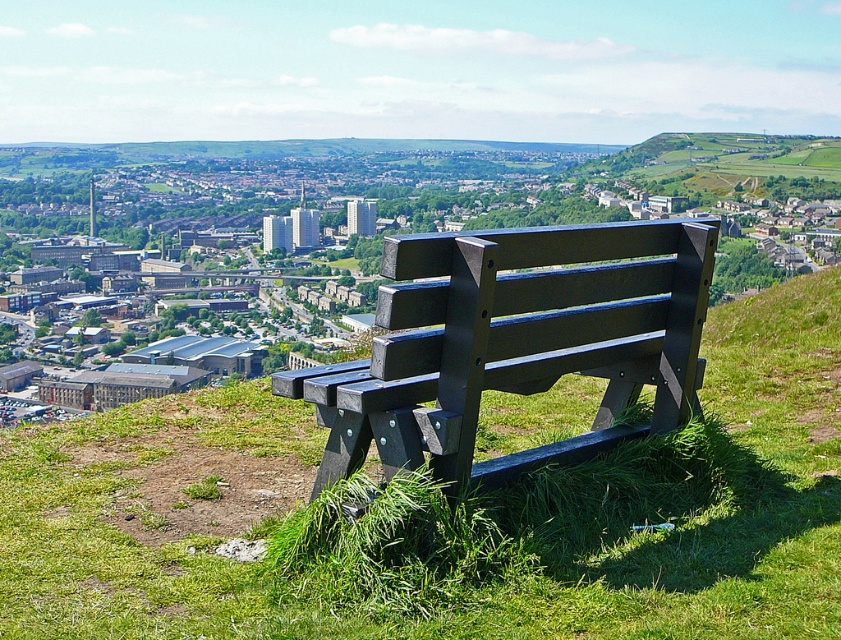
From the picture: You are planning to place a small potted plant between the green grassy bench at center and the matte black bench at center. Which bench should you place it closer to if you want the plant to be near the larger one?

The green grassy bench at center is bigger than the matte black bench at center, so you should place the plant closer to the green grassy bench at center.

You are a landscape architect designing a new park. You have two benches to place in the central area. The green grassy bench at center and the matte black bench at center. The park has a strict rule that benches must be at least 8 feet apart to ensure visitors have enough space. Based on the image, can both benches be placed in the central area without violating the rule?

The green grassy bench at center and the matte black bench at center are 7.27 feet apart from each other. Since 7.27 feet is less than the required 8 feet, placing them in the central area would violate the park rule.

You are planning to place a small garden ornament that requires 1.2 meters of space. You have two options for placement near the green grassy bench at center and the matte black bench at center. Based on their widths, which bench can accommodate the ornament without overcrowding?

The green grassy bench at center has a larger width than the matte black bench at center, so it can accommodate the ornament without overcrowding since it provides more space.